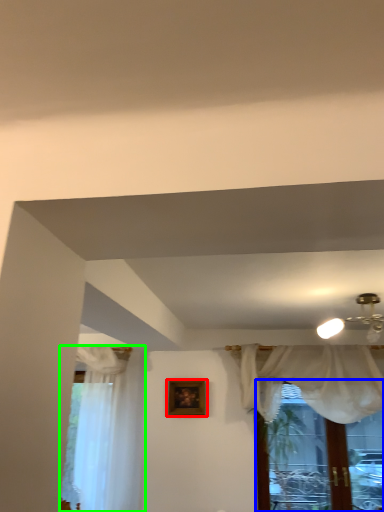
Question: Which object is positioned farthest from picture frame (highlighted by a red box)? Select from window (highlighted by a blue box) and curtain (highlighted by a green box).

Choices:
 (A) window
 (B) curtain

Answer: (A)